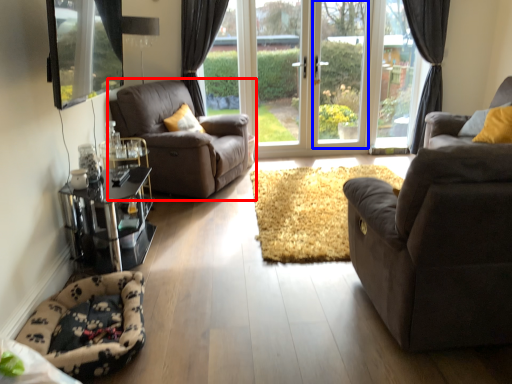
Question: Among these objects, which one is nearest to the camera, chair (highlighted by a red box) or window frame (highlighted by a blue box)?

Choices:
 (A) chair
 (B) window frame

Answer: (A)